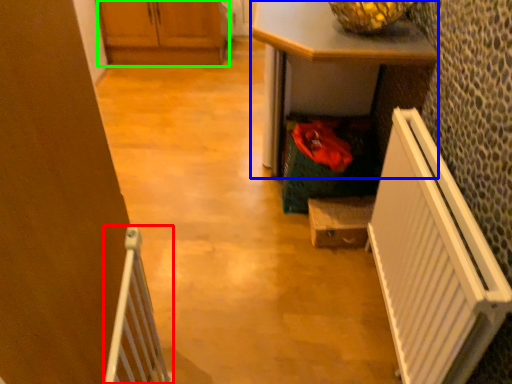
Question: Which object is the farthest from radiator (highlighted by a red box)? Choose among these: desk (highlighted by a blue box) or cabinetry (highlighted by a green box).

Choices:
 (A) desk
 (B) cabinetry

Answer: (B)